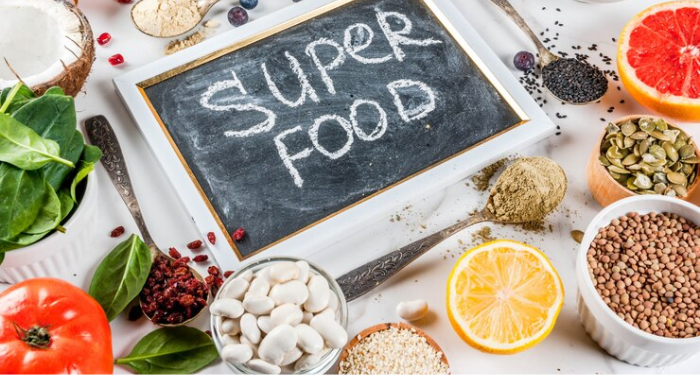
At what (x,y) coordinates should I click in order to perform the action: click on spoon. Please return your answer as a coordinate pair (x, y). Looking at the image, I should click on (377, 266).